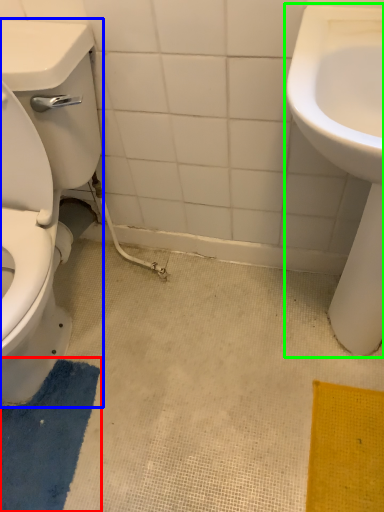
Question: Considering the real-world distances, which object is farthest from bath mat (highlighted by a red box)? porcelain (highlighted by a blue box) or sink (highlighted by a green box)?

Choices:
 (A) porcelain
 (B) sink

Answer: (B)